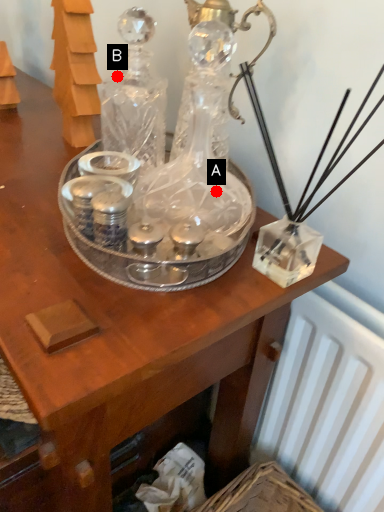
Question: Two points are circled on the image, labeled by A and B beside each circle. Which point is further to the camera?

Choices:
 (A) A is further
 (B) B is further

Answer: (B)